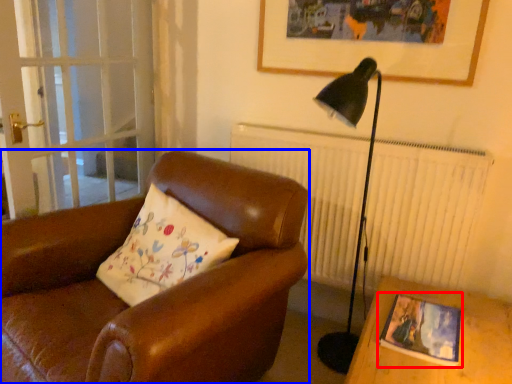
Question: Which of the following is the farthest to the observer, picture frame (highlighted by a red box) or chair (highlighted by a blue box)?

Choices:
 (A) picture frame
 (B) chair

Answer: (B)